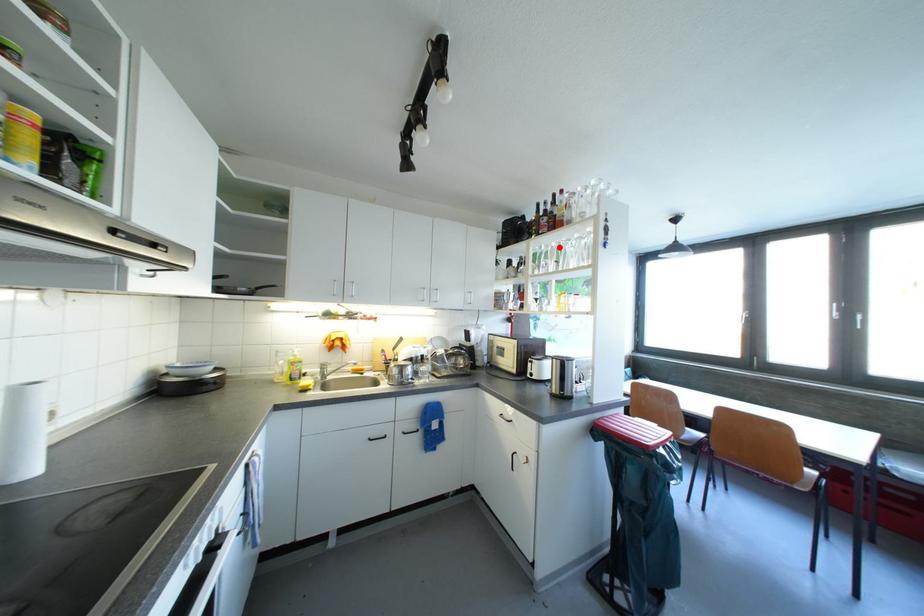
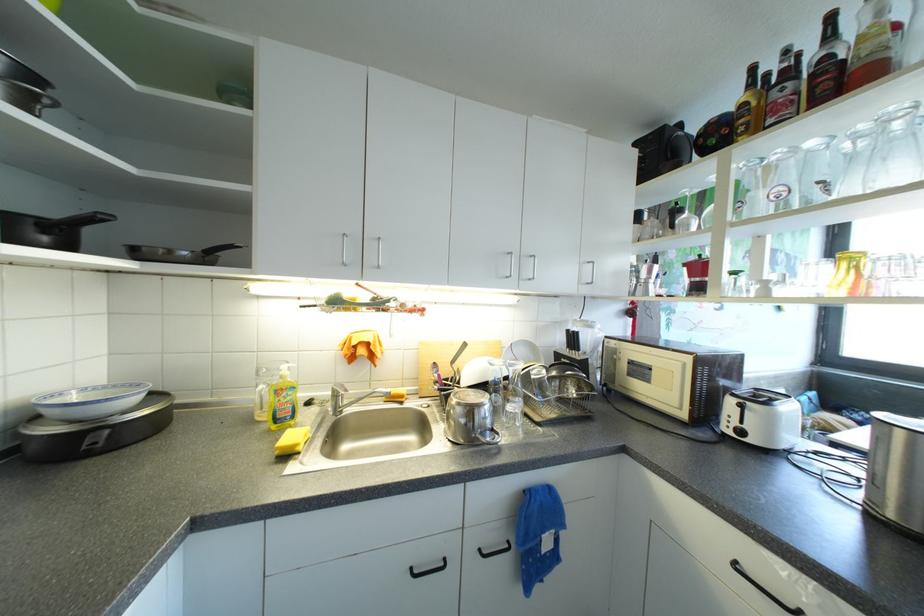
In the second image, find the point that corresponds to the highlighted location in the first image.

(818, 146)